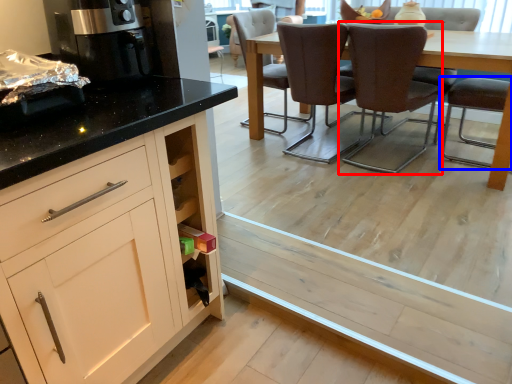
Question: Which of the following is the farthest to the observer, chair (highlighted by a red box) or chair (highlighted by a blue box)?

Choices:
 (A) chair
 (B) chair

Answer: (A)